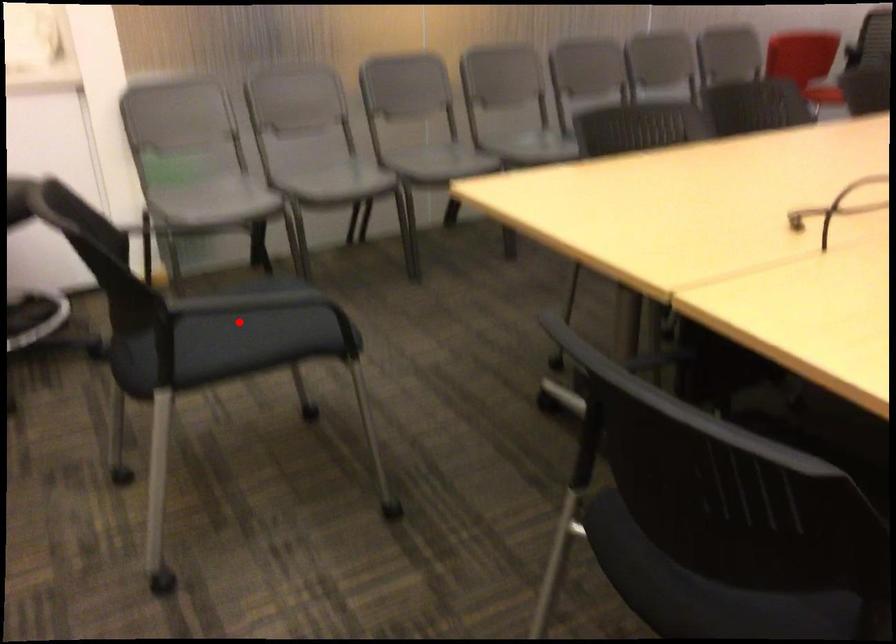
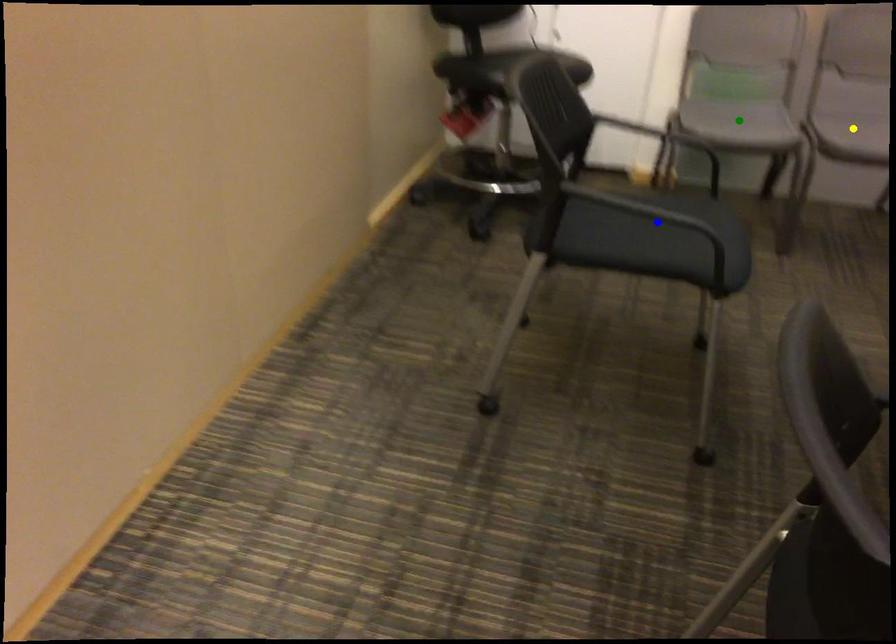
Question: I am providing you with two images of the same scene from different viewpoints. A red point is marked on the first image. You are given multiple points on the second image. Which point in image 2 represents the same 3d spot as the red point in image 1?

Choices:
 (A) blue point
 (B) yellow point
 (C) green point

Answer: (A)